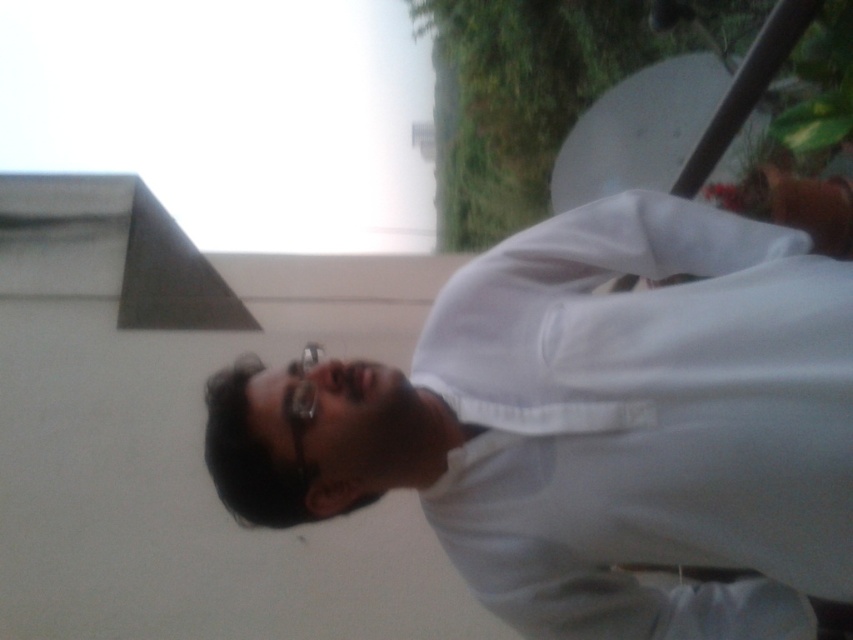
You are a photographer trying to capture the perfect shot of the person in the white matte shirt at center. To do this, you need to adjust your camera to focus precisely on the shirt. Given that the shirt is positioned at coordinates point 0.666, 0.696, what are the exact coordinates you should set your camera to target?

The exact coordinates to target the white matte shirt at center are point (593, 426).